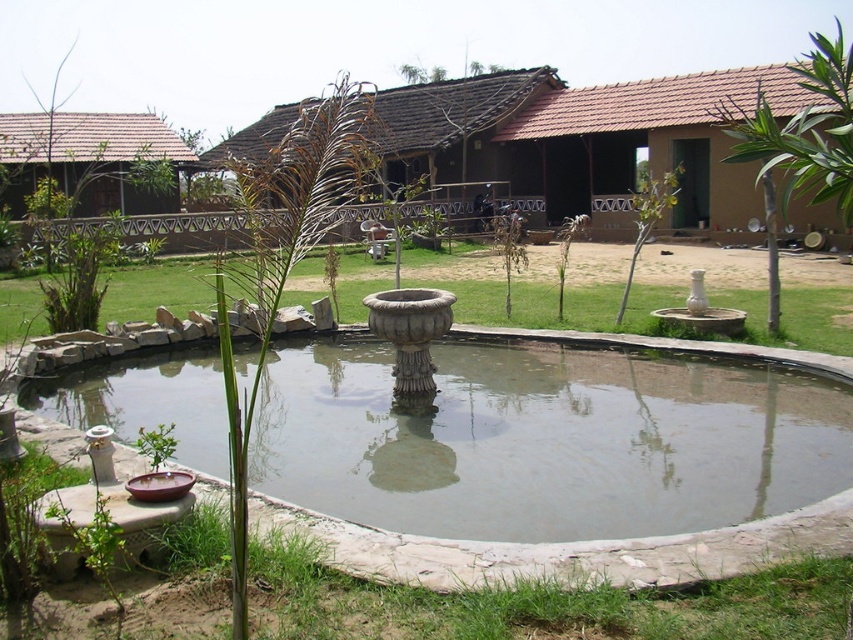
You are designing a layout for a garden and want to place a new statue that requires a base wider than the brown clay hut at center. Can the clear water at pond center provide a suitable base for this statue?

The clear water at pond center is thinner than the brown clay hut at center, so it cannot provide a suitable base for the statue since it is narrower than the required width.

You are a visitor at the pond and want to know which object is taller between the clear water at pond center and the brown thatched hut at left. Can you tell me?

The clear water at pond center has a lesser height compared to brown thatched hut at left, so the brown thatched hut at left is taller.